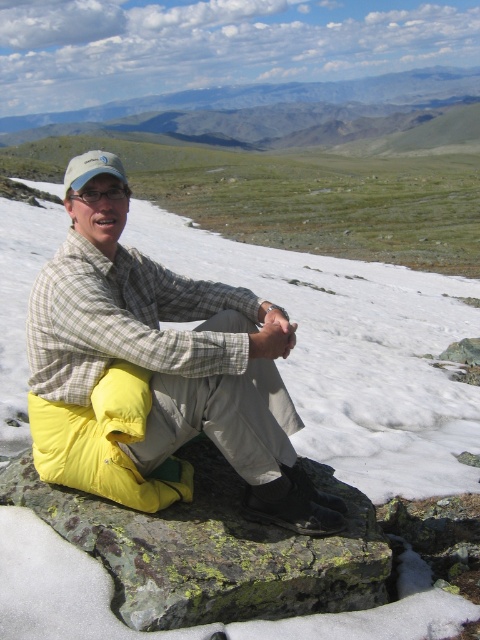
Question: Which object appears closest to the camera in this image?

Choices:
 (A) green mossy rock at center
 (B) yellow fabric sleeping pad at center
 (C) green grassy plain at upper center

Answer: (A)

Question: In this image, where is green mossy rock at center located relative to green grassy plain at upper center?

Choices:
 (A) right
 (B) left

Answer: (A)

Question: Is yellow fabric sleeping pad at center further to the viewer compared to green grassy plain at upper center?

Choices:
 (A) no
 (B) yes

Answer: (A)

Question: Is yellow fabric sleeping pad at center positioned at the back of green mossy rock at center?

Choices:
 (A) no
 (B) yes

Answer: (B)

Question: Which of the following is the farthest from the observer?

Choices:
 (A) green grassy plain at upper center
 (B) green mossy rock at center
 (C) yellow fabric sleeping pad at center

Answer: (A)

Question: Which object appears farthest from the camera in this image?

Choices:
 (A) green mossy rock at center
 (B) green grassy plain at upper center
 (C) yellow fabric sleeping pad at center

Answer: (B)